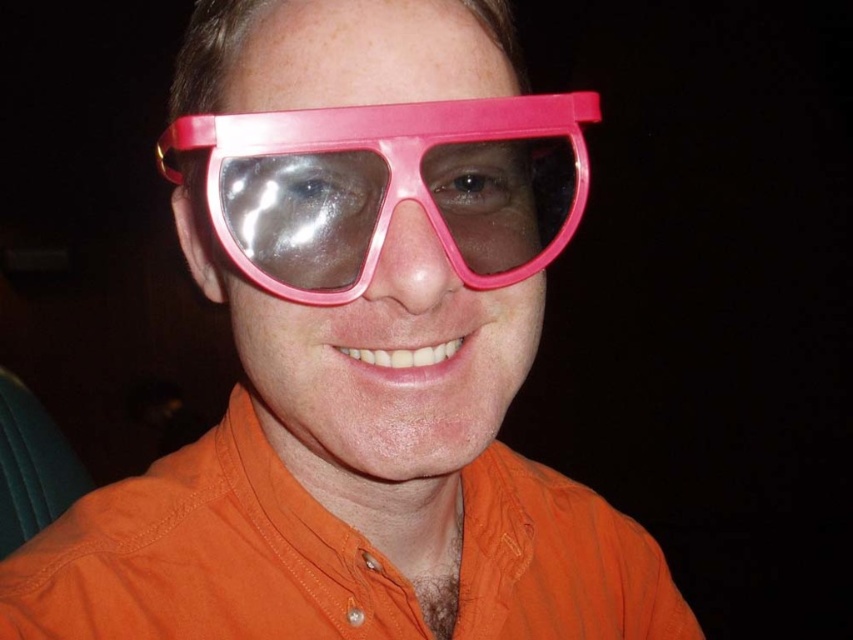
You are a photographer adjusting the lighting for a portrait. You notice the orange cotton shirt at center and the pink plastic goggles at center. Which object is closer to the camera lens?

The orange cotton shirt at center is closer to the camera lens because the pink plastic goggles at center are positioned behind it.